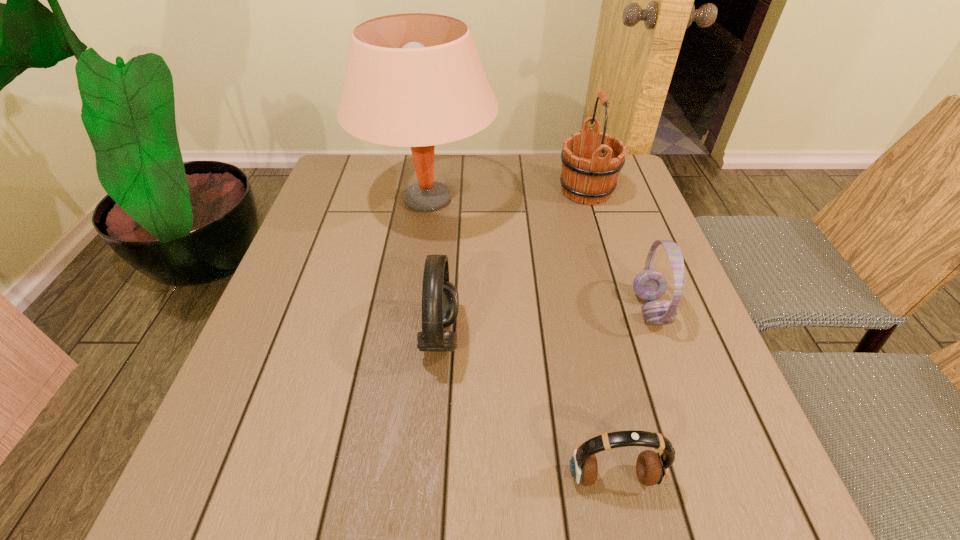
You are a GUI agent. You are given a task and a screenshot of the screen. Output one action in this format:
    pyautogui.click(x=<x>, y=<y>)
    Task: Click on the free space that satisfies the following two spatial constraints: 1. on the headband and ear cups of the rightmost headset; 2. on the ear cup of the shortest headset
    The width and height of the screenshot is (960, 540).
    Given the screenshot: What is the action you would take?
    pyautogui.click(x=710, y=477)